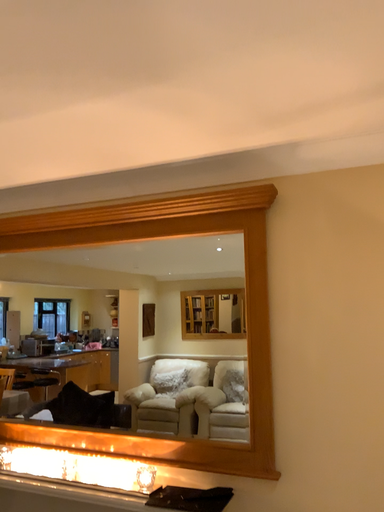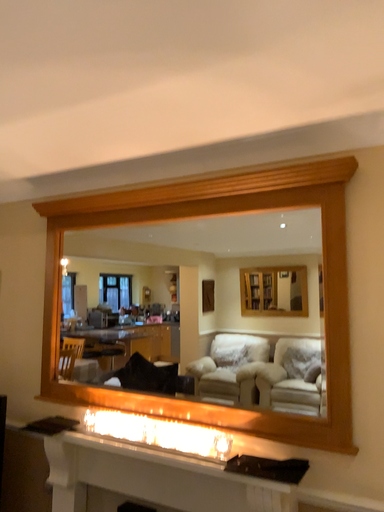
Question: Which way did the camera rotate in the video?

Choices:
 (A) rotated right
 (B) rotated left

Answer: (B)